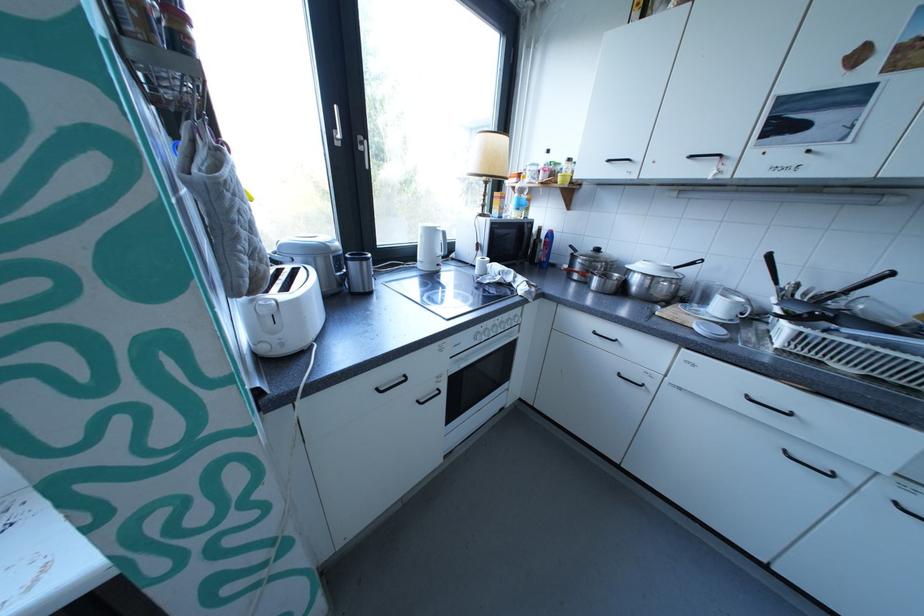
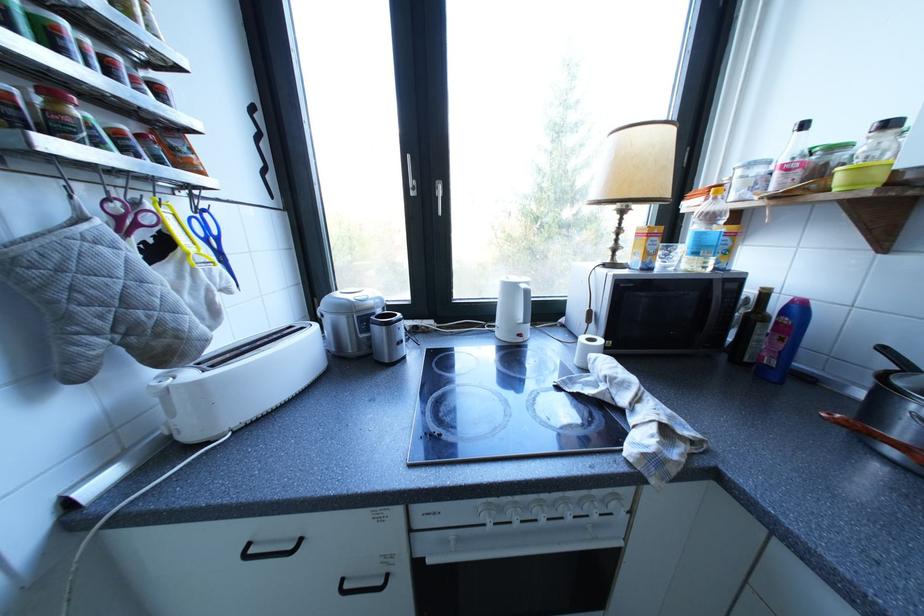
In the second image, find the point that corresponds to pixel 480 355 in the first image.

(470, 540)